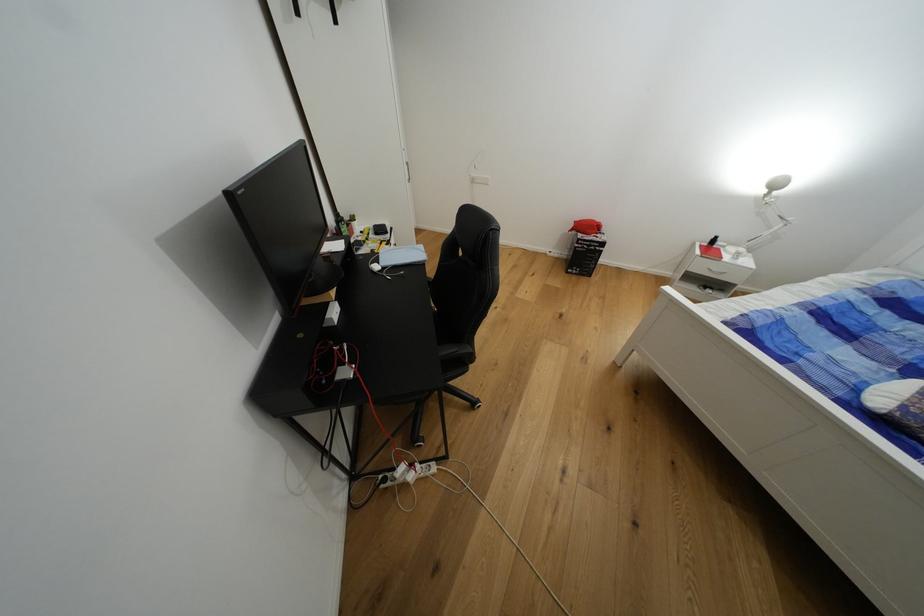
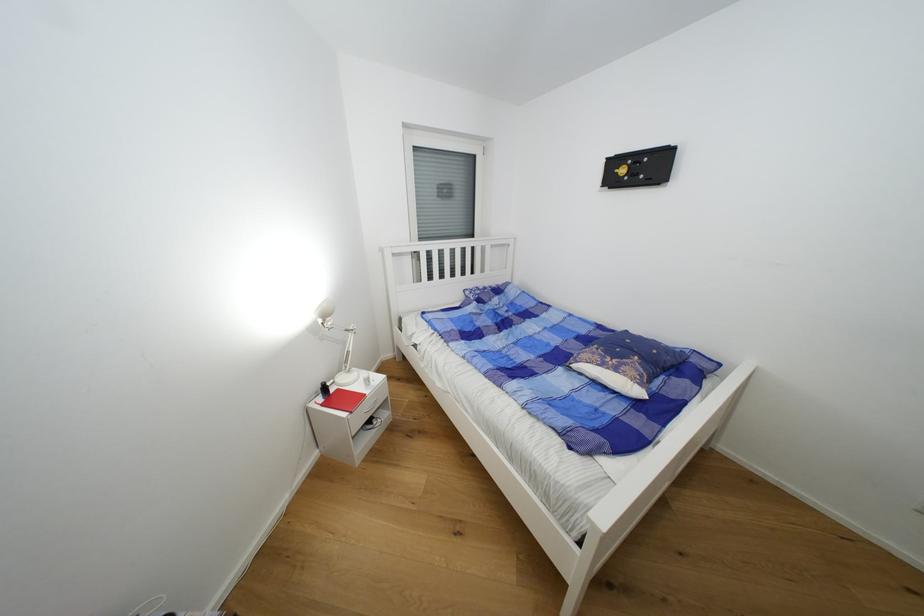
The point at (771, 193) is marked in the first image. Where is the corresponding point in the second image?

(325, 323)